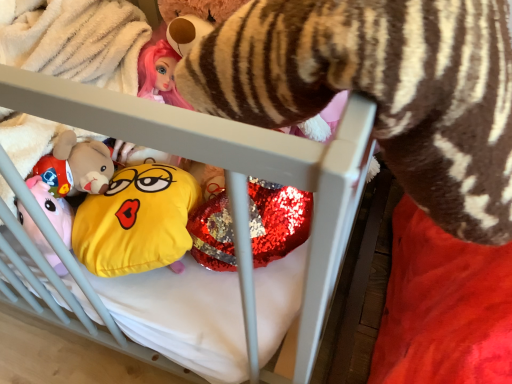
Question: Does white plastic crib at center have a greater height compared to yellow fabric emoji pillow at center?

Choices:
 (A) yes
 (B) no

Answer: (A)

Question: Does white plastic crib at center have a smaller size compared to yellow fabric emoji pillow at center?

Choices:
 (A) yes
 (B) no

Answer: (B)

Question: Is white plastic crib at center not within yellow fabric emoji pillow at center?

Choices:
 (A) no
 (B) yes

Answer: (B)

Question: Is yellow fabric emoji pillow at center located within white plastic crib at center?

Choices:
 (A) yes
 (B) no

Answer: (A)

Question: Can you confirm if white plastic crib at center is shorter than yellow fabric emoji pillow at center?

Choices:
 (A) no
 (B) yes

Answer: (A)

Question: Does white plastic crib at center have a larger size compared to yellow fabric emoji pillow at center?

Choices:
 (A) no
 (B) yes

Answer: (B)

Question: Is yellow fabric emoji pillow at center smaller than white plastic crib at center?

Choices:
 (A) yes
 (B) no

Answer: (A)

Question: Considering the relative positions of yellow fabric emoji pillow at center and white plastic crib at center in the image provided, is yellow fabric emoji pillow at center to the left of white plastic crib at center from the viewer's perspective?

Choices:
 (A) yes
 (B) no

Answer: (B)

Question: From the image's perspective, is yellow fabric emoji pillow at center beneath white plastic crib at center?

Choices:
 (A) yes
 (B) no

Answer: (A)

Question: Is yellow fabric emoji pillow at center next to white plastic crib at center?

Choices:
 (A) yes
 (B) no

Answer: (B)

Question: From a real-world perspective, is yellow fabric emoji pillow at center positioned under white plastic crib at center based on gravity?

Choices:
 (A) no
 (B) yes

Answer: (B)

Question: Does yellow fabric emoji pillow at center turn towards white plastic crib at center?

Choices:
 (A) no
 (B) yes

Answer: (B)

Question: Choose the correct answer: Is yellow fabric emoji pillow at center inside white plastic crib at center or outside it?

Choices:
 (A) outside
 (B) inside

Answer: (B)